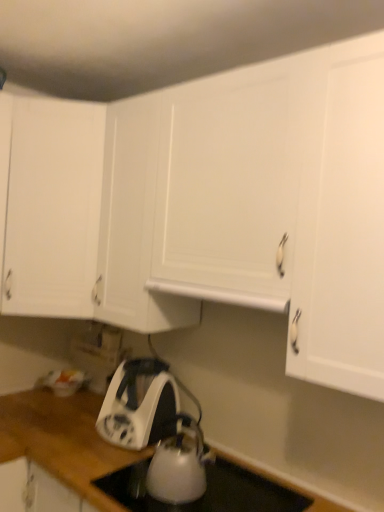
Question: Does white matte exhaust hood at center contain white matte cabinet at upper left?

Choices:
 (A) no
 (B) yes

Answer: (A)

Question: Is white matte exhaust hood at center with white matte cabinet at upper left?

Choices:
 (A) no
 (B) yes

Answer: (A)

Question: Does white matte exhaust hood at center have a larger size compared to white matte cabinet at upper left?

Choices:
 (A) no
 (B) yes

Answer: (A)

Question: From a real-world perspective, is white matte exhaust hood at center physically below white matte cabinet at upper left?

Choices:
 (A) no
 (B) yes

Answer: (B)

Question: Does white matte exhaust hood at center have a greater height compared to white matte cabinet at upper left?

Choices:
 (A) no
 (B) yes

Answer: (A)

Question: Considering the relative positions of white matte exhaust hood at center and white matte cabinet at upper left in the image provided, is white matte exhaust hood at center behind white matte cabinet at upper left?

Choices:
 (A) no
 (B) yes

Answer: (A)

Question: Does white matte cabinet at upper left have a greater width compared to white glossy electric kettle at lower center?

Choices:
 (A) yes
 (B) no

Answer: (A)

Question: Is white matte cabinet at upper left taller than white glossy electric kettle at lower center?

Choices:
 (A) no
 (B) yes

Answer: (B)

Question: Is white matte cabinet at upper left not inside white glossy electric kettle at lower center?

Choices:
 (A) no
 (B) yes

Answer: (B)

Question: From the image's perspective, is white matte cabinet at upper left located beneath white glossy electric kettle at lower center?

Choices:
 (A) no
 (B) yes

Answer: (A)

Question: From the image's perspective, is white matte cabinet at upper left over white glossy electric kettle at lower center?

Choices:
 (A) no
 (B) yes

Answer: (B)

Question: Can you confirm if white matte cabinet at upper left is bigger than white glossy electric kettle at lower center?

Choices:
 (A) no
 (B) yes

Answer: (B)

Question: Could white glossy kettle at lower center be considered to be inside white glossy electric kettle at lower center?

Choices:
 (A) no
 (B) yes

Answer: (A)